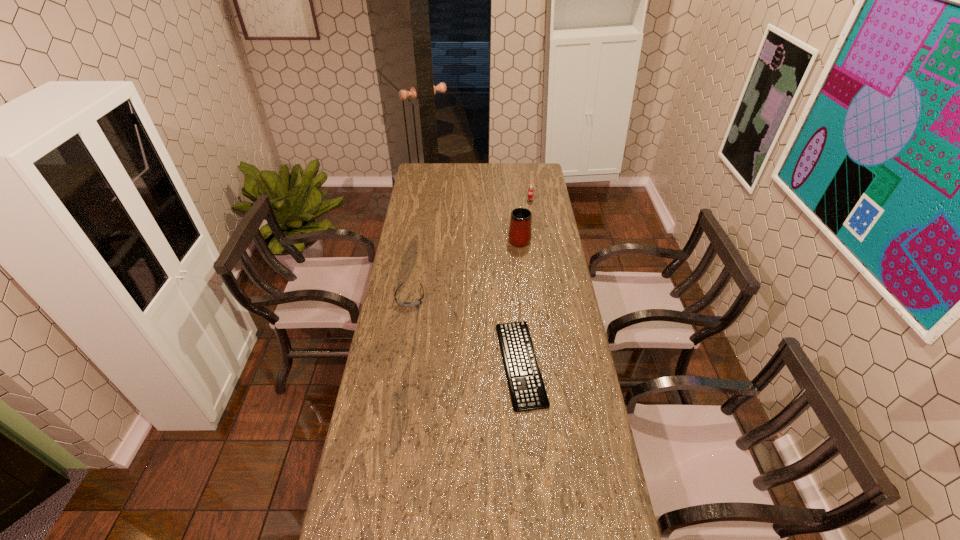
Locate an element on the screen. The width and height of the screenshot is (960, 540). vacant space situated 0.110m on the side of the third nearest object with the handle is located at coordinates (516, 216).

What are the coordinates of `blank space located 0.280m on the label of the rightmost object` in the screenshot? It's located at (535, 237).

Find the location of `vacant space located on the lenses of the third tallest object`. vacant space located on the lenses of the third tallest object is located at coordinates (397, 376).

Identify the location of free location located on the front of the nearest object. This screenshot has width=960, height=540. (528, 458).

Identify the location of object at the left edge. The width and height of the screenshot is (960, 540). (403, 304).

This screenshot has height=540, width=960. Find the location of `mug positioned at the right edge`. mug positioned at the right edge is located at coordinates (520, 234).

Find the location of a particular element. This screenshot has width=960, height=540. soda bottle that is at the right edge is located at coordinates (530, 192).

Find the location of `computer keyboard located at the right edge`. computer keyboard located at the right edge is located at coordinates (526, 386).

The height and width of the screenshot is (540, 960). Find the location of `free location at the far edge`. free location at the far edge is located at coordinates (443, 178).

Locate an element on the screen. This screenshot has width=960, height=540. free region at the left edge of the desktop is located at coordinates (415, 202).